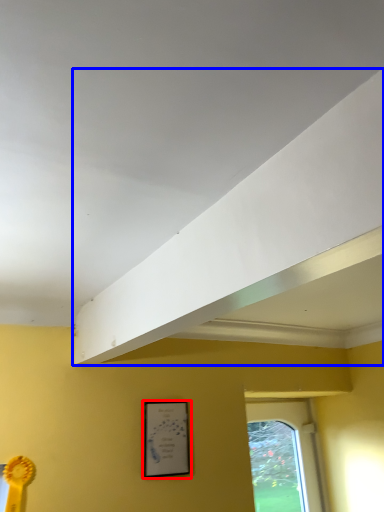
Question: Which object is further to the camera taking this photo, picture frame (highlighted by a red box) or exhaust hood (highlighted by a blue box)?

Choices:
 (A) picture frame
 (B) exhaust hood

Answer: (A)